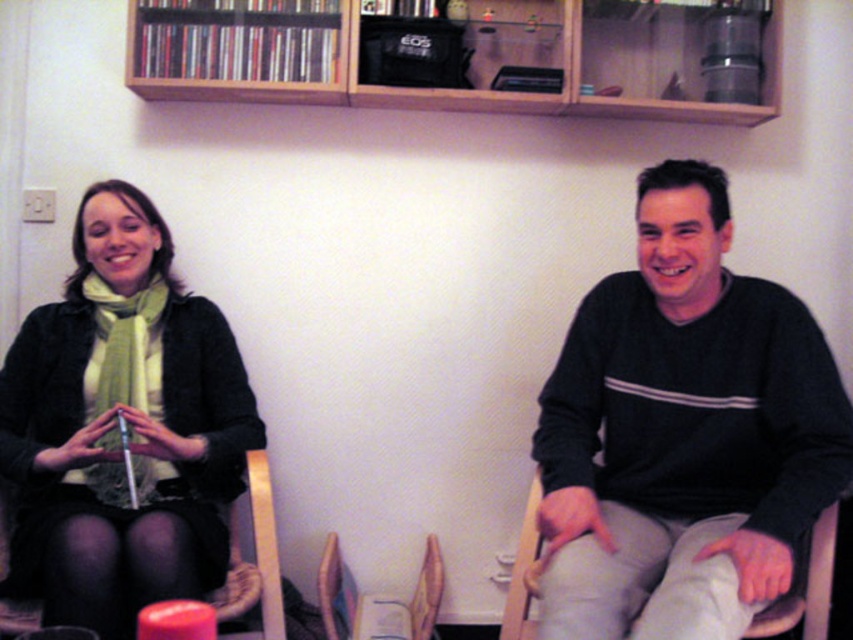
You are sitting on the wooden chair at lower left and want to reach the wooden bookshelf at upper center. Which direction should you move to get closer to it?

The wooden bookshelf at upper center is positioned on the right side of the wooden chair at lower left, so you should move to your right to get closer to it.

You are a photographer taking a picture of two people sitting in a living room. You notice two points marked in the image at coordinates point (480, 42) and point (264, 465). Which point should you focus on to ensure the person closer to the camera is in sharp focus?

Point (480, 42) is further to the camera than point (264, 465), so focusing on point (480, 42) will ensure the person closer to the camera is in sharp focus.

You are a visitor in this room and want to move from the wooden bookshelf at upper center to the wooden chair at lower left. Which direction should you move in relation to the bookshelf?

To move from the wooden bookshelf at upper center to the wooden chair at lower left, you should move downward and to the left since the chair is positioned lower and to the left relative to the bookshelf.